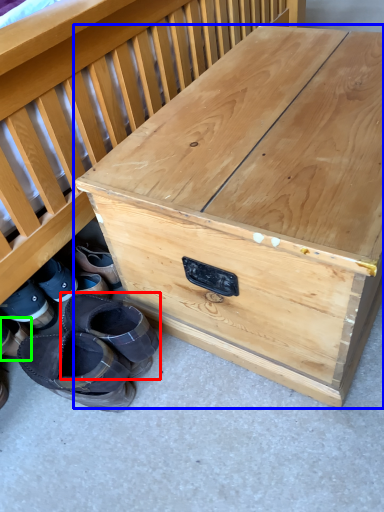
Question: Which object is the closest to the footwear (highlighted by a red box)? Choose among these: table (highlighted by a blue box) or footwear (highlighted by a green box).

Choices:
 (A) table
 (B) footwear

Answer: (B)